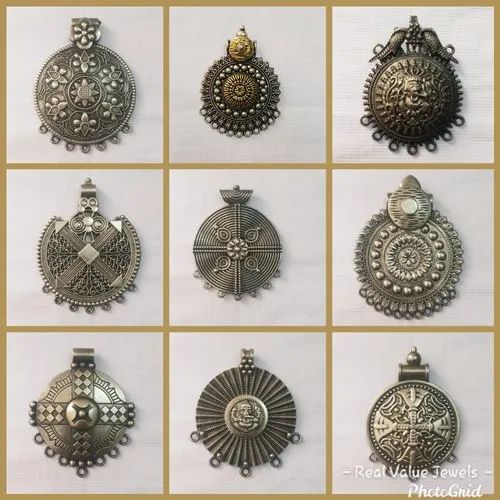
Where is `centers of decorative pieces`? This screenshot has height=500, width=500. centers of decorative pieces is located at coordinates (87, 91), (236, 252), (88, 252), (83, 412), (244, 418), (416, 423), (411, 256), (415, 93), (240, 91).